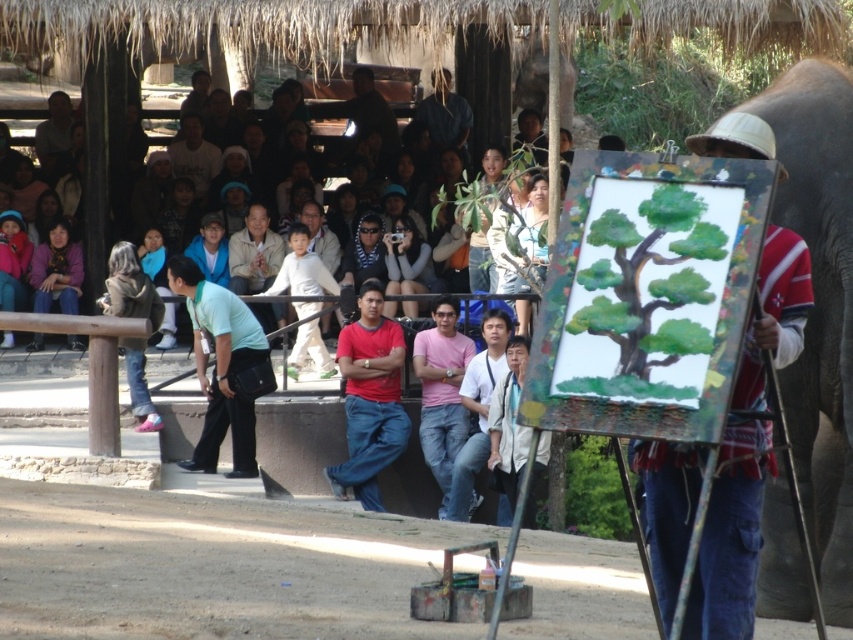
Question: Is light brown leather jacket at center closer to camera compared to matte black shirt at center?

Choices:
 (A) yes
 (B) no

Answer: (B)

Question: Can you confirm if green matte tree at center is smaller than light green fabric shirt at center?

Choices:
 (A) no
 (B) yes

Answer: (B)

Question: Which point is farther to the camera?

Choices:
 (A) (669, 204)
 (B) (62, 170)
 (C) (496, 477)

Answer: (B)

Question: Does red matte shirt at center have a larger size compared to light brown leather jacket at center?

Choices:
 (A) no
 (B) yes

Answer: (B)

Question: Which point is closer to the camera?

Choices:
 (A) (341, 342)
 (B) (607, 262)

Answer: (B)

Question: Which point is closer to the camera?

Choices:
 (A) (251, 232)
 (B) (824, 218)

Answer: (B)